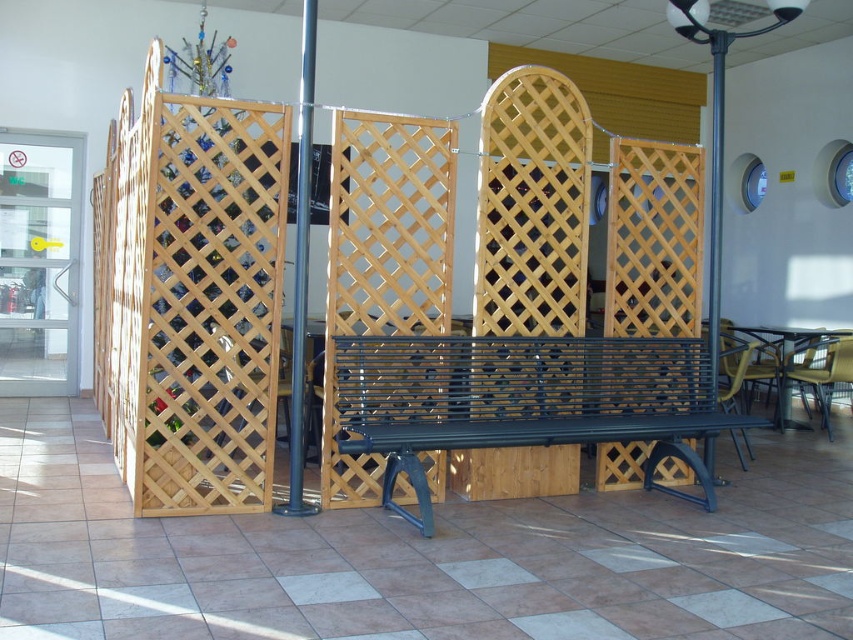
Question: Which object appears farthest from the camera in this image?

Choices:
 (A) natural wood lattice at center
 (B) metallic pole at right
 (C) black metal bench at center
 (D) metallic pole at center

Answer: (B)

Question: Does natural wood lattice at center appear on the left side of black metal bench at center?

Choices:
 (A) yes
 (B) no

Answer: (A)

Question: Is black metal bench at center positioned at the back of metallic pole at right?

Choices:
 (A) no
 (B) yes

Answer: (A)

Question: Is black metal bench at center to the right of metallic pole at center from the viewer's perspective?

Choices:
 (A) no
 (B) yes

Answer: (B)

Question: Which object is closer to the camera taking this photo?

Choices:
 (A) metallic pole at right
 (B) metallic pole at center

Answer: (B)

Question: Which of the following is the farthest from the observer?

Choices:
 (A) black metal bench at center
 (B) metallic pole at center
 (C) metallic pole at right

Answer: (C)